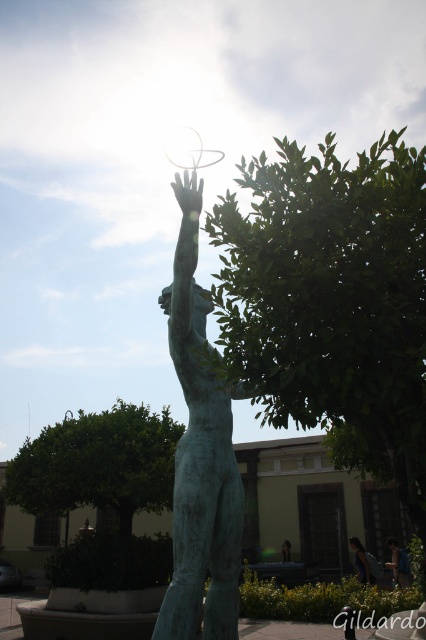
You are standing in front of a bronze statue of a human figure reaching upwards with a circular object. There is a green leafy tree at center. If you want to take a photo of the statue with the tree in the background, will the tree be in focus if your camera is set to focus on the statue?

The green leafy tree at center is 4.13 meters away from you. Since the statue is closer than the tree, if your camera focuses on the statue, the tree might be out of focus depending on the depth of field. However, without knowing the exact depth of field settings, it is uncertain. But given the distance difference, there is a possibility the tree may not be in focus.

You are standing in front of the bronze statue and want to take a photo of the green leafy tree at center without the statue blocking the view. Is there enough space to the left or right of the statue to capture the tree in the frame?

The green leafy tree at center is located at point (333, 301), which means it is positioned to the right side of the statue. Therefore, moving to the left of the statue would provide an unobstructed view of the tree without the statue blocking it.